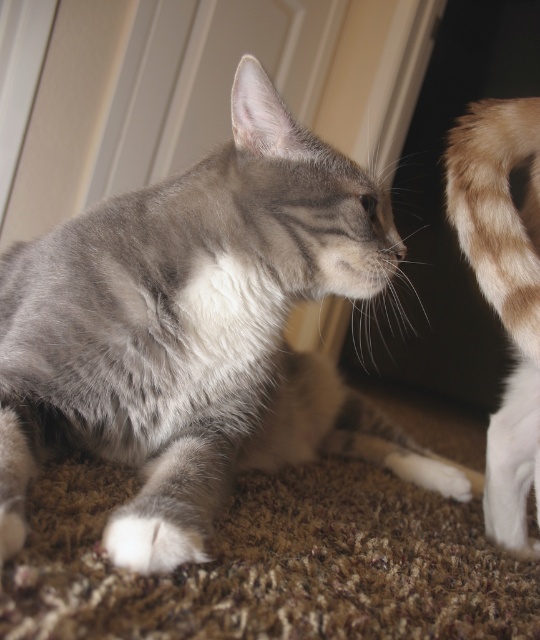
You are a photographer trying to capture both the gray soft fur cat at center and the light brown fur tail at right in a single shot. Based on their positions, which cat is closer to the camera?

The gray soft fur cat at center is closer to the camera because it is in front of the light brown fur tail at right.

You are a cat owner trying to identify which part of your cats is closer to the edge of the photo. You see the light brown fur tail at right and the white soft fur paw at lower left. Which one is closer to the right edge of the photo?

The light brown fur tail at right is positioned on the right side of the white soft fur paw at lower left, so it is closer to the right edge of the photo.